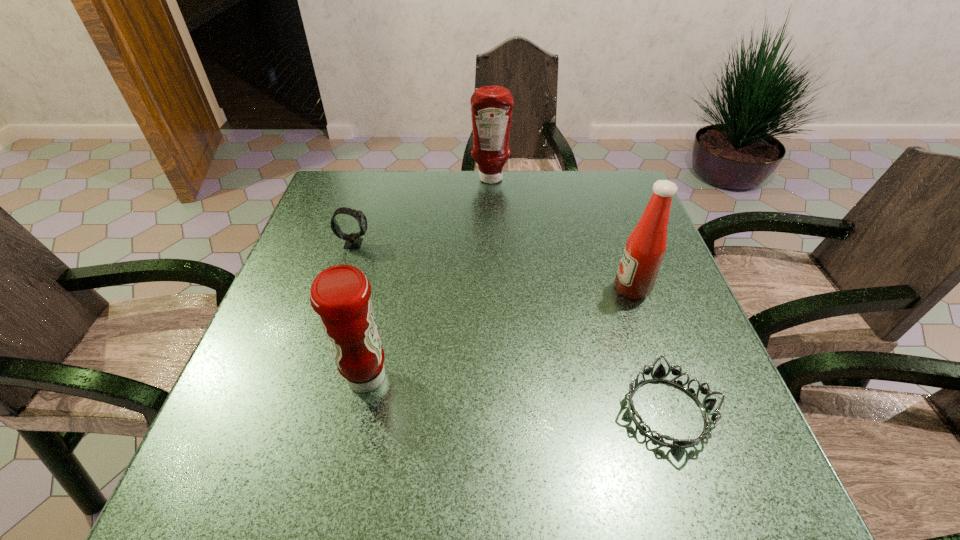
Find the location of a particular element. Image resolution: width=960 pixels, height=540 pixels. vacant space located on the front-facing side of the second nearest condiment is located at coordinates (550, 288).

I want to click on vacant space located on the front-facing side of the second nearest condiment, so click(480, 288).

At what (x,y) coordinates should I click in order to perform the action: click on vacant space located 0.310m on the front-facing side of the second nearest condiment. Please return your answer as a coordinate pair (x, y). Looking at the image, I should click on (480, 288).

I want to click on vacant space situated on the back of the leftmost condiment, so click(379, 316).

The height and width of the screenshot is (540, 960). Identify the location of free space located 0.280m on the face of the leftmost object. (479, 243).

Where is `free space located 0.320m on the front-facing side of the shortest object`? free space located 0.320m on the front-facing side of the shortest object is located at coordinates (443, 412).

The image size is (960, 540). Identify the location of free space located on the front-facing side of the shortest object. (554, 412).

The image size is (960, 540). In order to click on free space located on the front-facing side of the shortest object in this screenshot , I will do `click(560, 412)`.

Identify the location of object located at the far edge. (491, 106).

You are a GUI agent. You are given a task and a screenshot of the screen. Output one action in this format:
    pyautogui.click(x=<x>, y=<y>)
    Task: Click on the object positioned at the near edge
    The width and height of the screenshot is (960, 540).
    Given the screenshot: What is the action you would take?
    pyautogui.click(x=707, y=405)